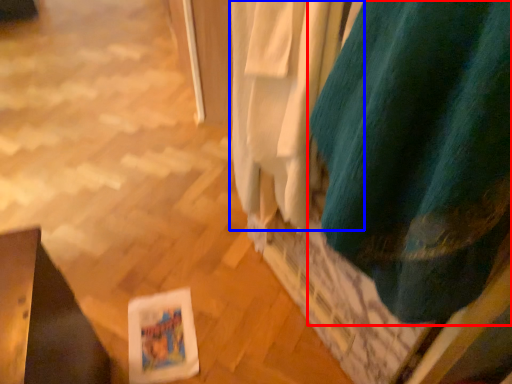
Question: Which point is further to the camera, curtain (highlighted by a red box) or curtain (highlighted by a blue box)?

Choices:
 (A) curtain
 (B) curtain

Answer: (B)